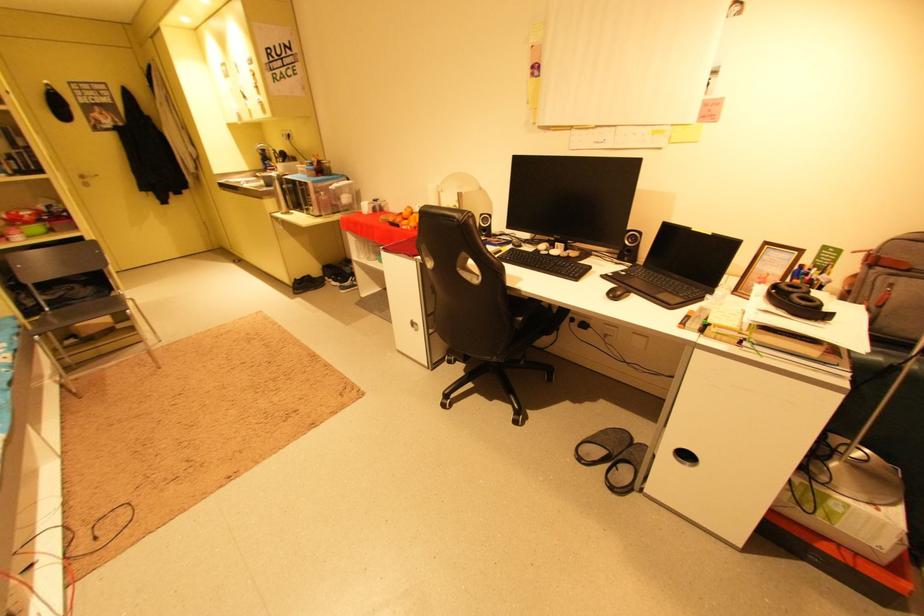
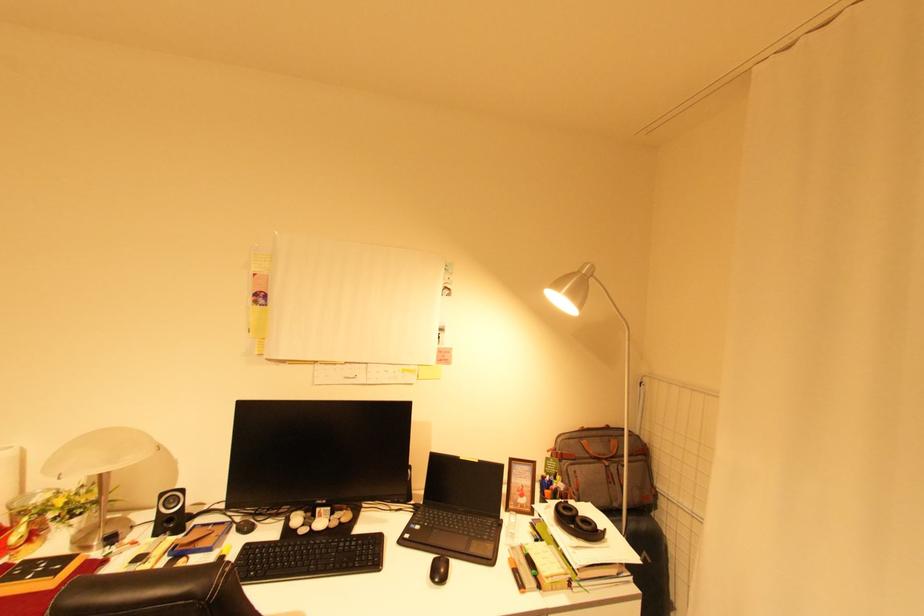
The point at (804, 297) is marked in the first image. Where is the corresponding point in the second image?

(585, 521)